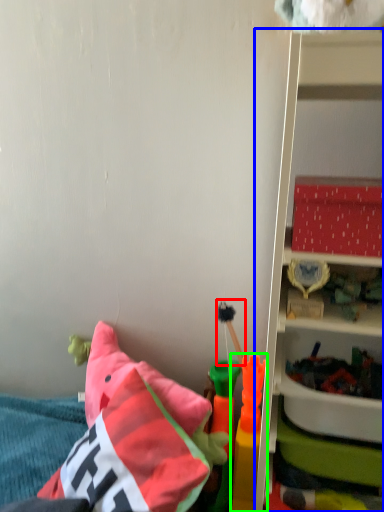
Question: Estimate the real-world distances between objects in this image. Which object is closer to toy (highlighted by a red box), shelf (highlighted by a blue box) or toy (highlighted by a green box)?

Choices:
 (A) shelf
 (B) toy

Answer: (B)